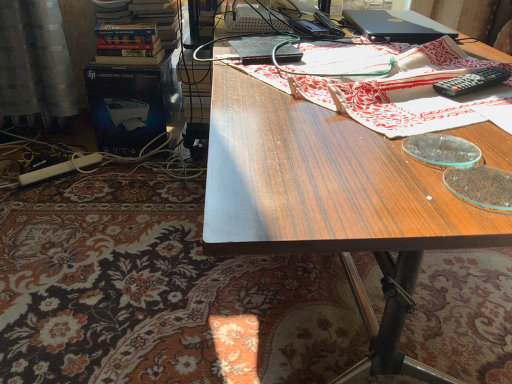
Question: Looking at their shapes, would you say black matte laptop at upper right is wider or thinner than wooden table at center?

Choices:
 (A) thin
 (B) wide

Answer: (A)

Question: Is black matte laptop at upper right in front of or behind wooden table at center in the image?

Choices:
 (A) front
 (B) behind

Answer: (B)

Question: Considering the real-world distances, which object is farthest from the satin curtain at left?

Choices:
 (A) black plastic remote control at upper right
 (B) wooden table at center
 (C) black matte laptop at upper right
 (D) wooden table at center
 (E) wooden desk at center

Answer: (A)

Question: Which object is the closest to the hardcover books at upper left?

Choices:
 (A) wooden desk at center
 (B) black plastic remote control at upper right
 (C) black matte laptop at upper right
 (D) wooden table at center
 (E) satin curtain at left

Answer: (E)